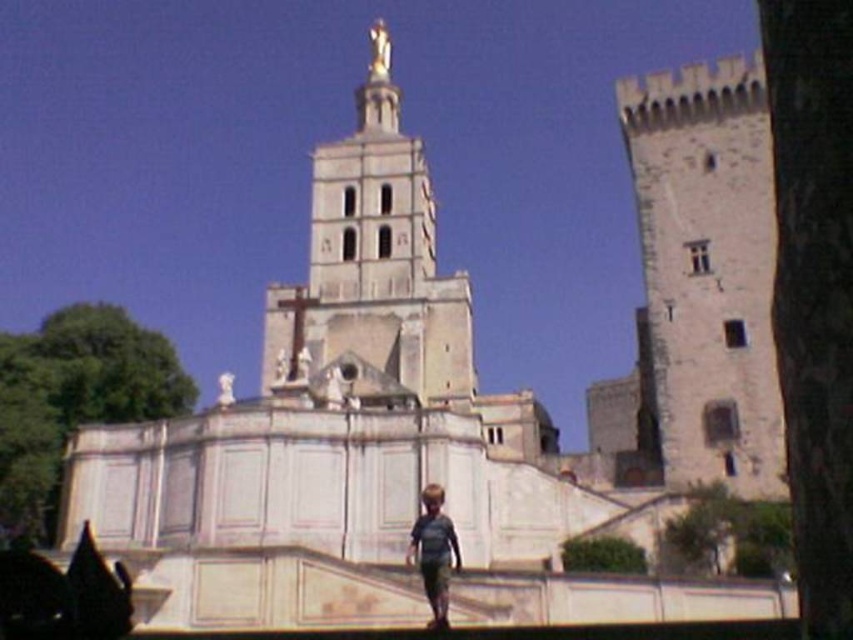
You are an architect assessing the structural integrity of the building. You notice the stone tower at right and the white stone tower at center. Which tower has a smaller width according to the measurements?

The stone tower at right has a smaller width than the white stone tower at center.